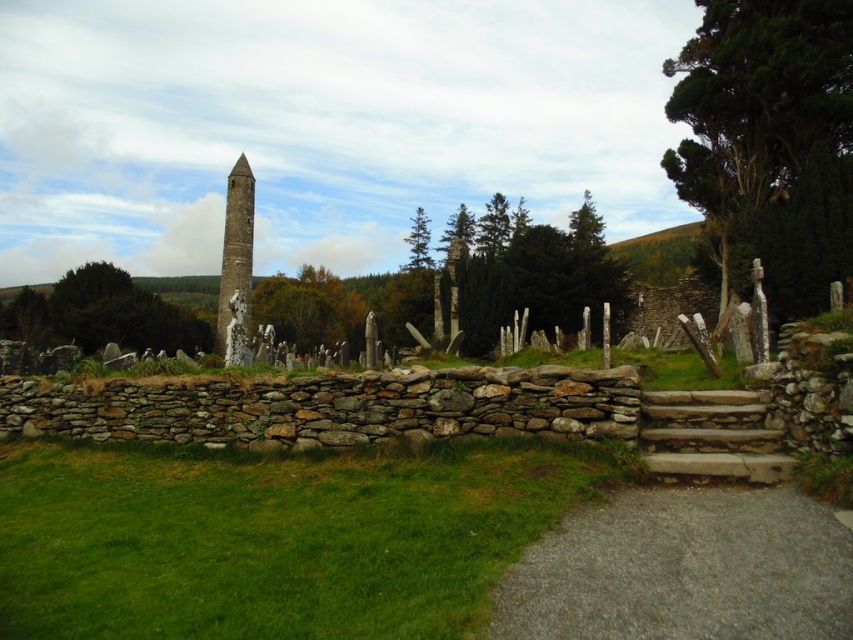
Is the position of green leafy tree at upper right less distant than that of green leafy tree at left?

Yes.

Is green leafy tree at upper right thinner than green leafy tree at left?

Indeed, green leafy tree at upper right has a lesser width compared to green leafy tree at left.

Is point (792, 20) behind point (22, 285)?

No, (792, 20) is in front of (22, 285).

Identify the location of green leafy tree at upper right. The height and width of the screenshot is (640, 853). (770, 138).

Can you confirm if green grass at lower left is positioned above smooth stone tower at center?

Incorrect, green grass at lower left is not positioned above smooth stone tower at center.

Does green grass at lower left have a greater width compared to smooth stone tower at center?

No.

The image size is (853, 640). What do you see at coordinates (274, 536) in the screenshot?
I see `green grass at lower left` at bounding box center [274, 536].

The height and width of the screenshot is (640, 853). In order to click on green grass at lower left in this screenshot , I will do `click(274, 536)`.

Who is more distant from viewer, (634, 467) or (843, 188)?

Point (843, 188)

Between green grass at lower left and green leafy tree at upper right, which one appears on the right side from the viewer's perspective?

From the viewer's perspective, green leafy tree at upper right appears more on the right side.

Identify the location of green grass at lower left. (x=274, y=536).

At what (x,y) coordinates should I click in order to perform the action: click on green grass at lower left. Please return your answer as a coordinate pair (x, y). This screenshot has height=640, width=853. Looking at the image, I should click on (274, 536).